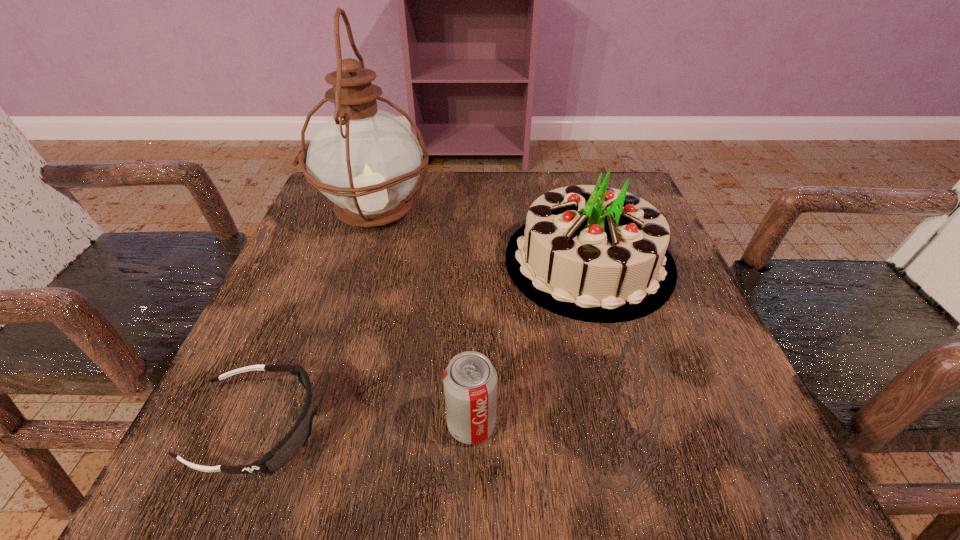
I want to click on oil lamp at the far edge, so click(x=365, y=160).

Where is `birthday cake present at the far edge`? The width and height of the screenshot is (960, 540). birthday cake present at the far edge is located at coordinates point(592,253).

The image size is (960, 540). Find the location of `soda can situated at the near edge`. soda can situated at the near edge is located at coordinates (470, 380).

Locate an element on the screen. goggles located in the near edge section of the desktop is located at coordinates (296, 438).

The image size is (960, 540). What are the coordinates of `oil lamp situated at the left edge` in the screenshot? It's located at (365, 160).

Identify the location of goggles that is at the left edge. The height and width of the screenshot is (540, 960). (296, 438).

This screenshot has width=960, height=540. I want to click on object located in the right edge section of the desktop, so click(x=592, y=253).

Locate an element on the screen. object present at the far left corner is located at coordinates (365, 160).

You are a GUI agent. You are given a task and a screenshot of the screen. Output one action in this format:
    pyautogui.click(x=<x>, y=<y>)
    Task: Click on the object positioned at the near left corner
    This screenshot has width=960, height=540.
    Given the screenshot: What is the action you would take?
    pyautogui.click(x=296, y=438)

I want to click on object located at the far right corner, so click(592, 253).